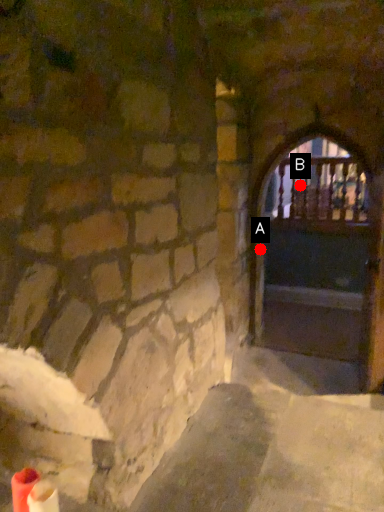
Question: Two points are circled on the image, labeled by A and B beside each circle. Which point is further to the camera?

Choices:
 (A) A is further
 (B) B is further

Answer: (B)